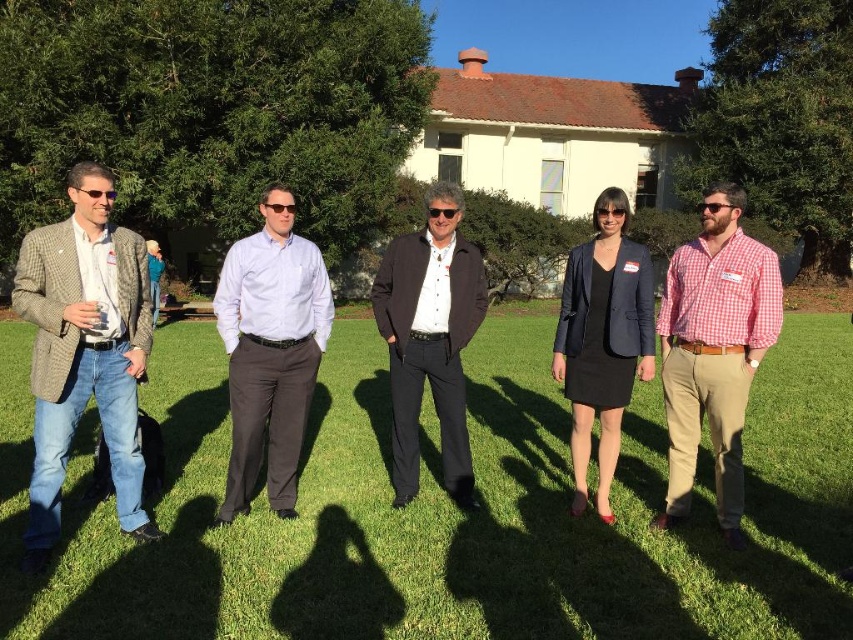
Question: Can you confirm if matte black pants at center is smaller than red checkered shirt at center?

Choices:
 (A) yes
 (B) no

Answer: (B)

Question: Is red checkered shirt at center further to the viewer compared to dark brown leather jacket at center?

Choices:
 (A) no
 (B) yes

Answer: (A)

Question: Among these points, which one is nearest to the camera?

Choices:
 (A) (36, 394)
 (B) (151, 614)
 (C) (234, 312)

Answer: (B)

Question: Among these points, which one is farthest from the camera?

Choices:
 (A) (51, 248)
 (B) (267, 308)
 (C) (614, 390)

Answer: (C)

Question: Does plaid wool blazer at left appear under glossy plastic sunglasses at center?

Choices:
 (A) no
 (B) yes

Answer: (B)

Question: Which of the following is the closest to the observer?

Choices:
 (A) (447, 212)
 (B) (734, 285)
 (C) (625, 300)
 (D) (305, 278)

Answer: (B)